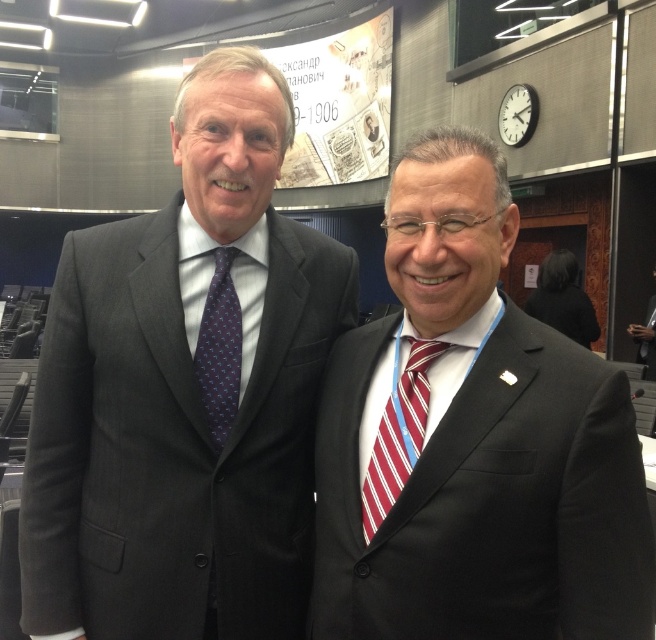
Question: Does matte black suit at right have a larger size compared to red striped tie at right?

Choices:
 (A) yes
 (B) no

Answer: (A)

Question: Which is nearer to the dark blue silk tie at center?

Choices:
 (A) matte black suit at right
 (B) dark gray suit at left

Answer: (B)

Question: Does dark gray suit at left appear over dark blue silk tie at center?

Choices:
 (A) yes
 (B) no

Answer: (B)

Question: Based on their relative distances, which object is farther from the red striped tie at right?

Choices:
 (A) matte black suit at right
 (B) dark gray suit at left
 (C) dark blue silk tie at center

Answer: (B)

Question: Which object is farther from the camera taking this photo?

Choices:
 (A) matte black suit at right
 (B) dark blue silk tie at center
 (C) dark gray suit at left

Answer: (B)

Question: Is red striped tie at right positioned behind dark blue silk tie at center?

Choices:
 (A) yes
 (B) no

Answer: (B)